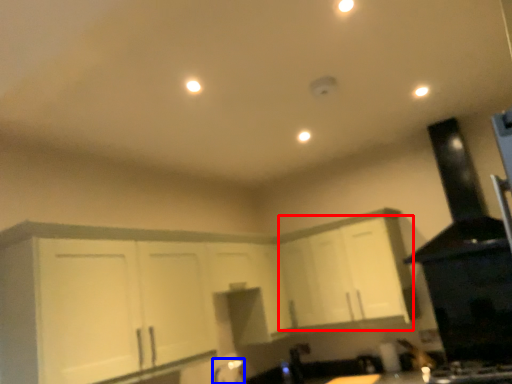
Question: Which point is closer to the camera, cabinetry (highlighted by a red box) or faucet (highlighted by a blue box)?

Choices:
 (A) cabinetry
 (B) faucet

Answer: (A)